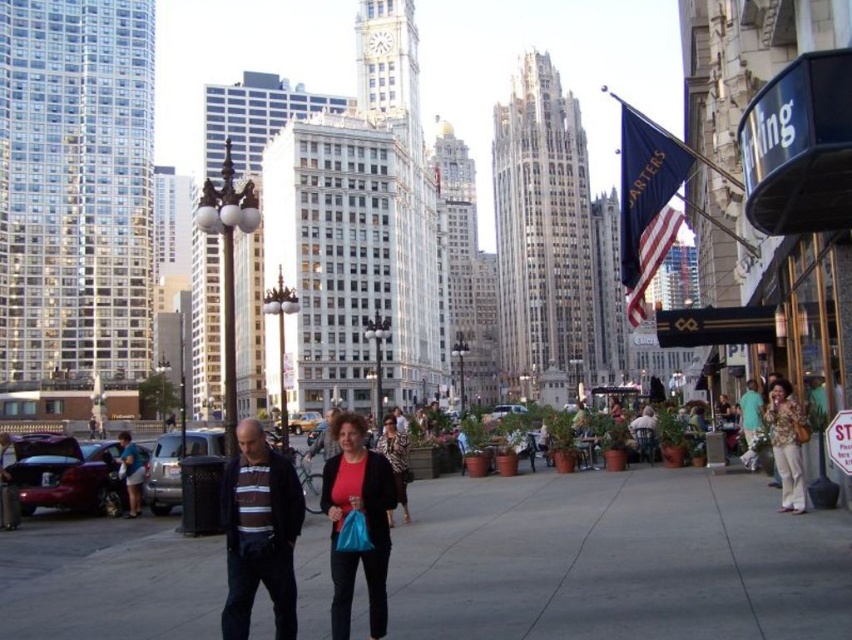
Is green cotton shirt at lower right positioned behind striped sweater at center?

Yes, green cotton shirt at lower right is further from the viewer.

Which is behind, point (747, 467) or point (320, 435)?

Point (320, 435)

Locate an element on the screen. The width and height of the screenshot is (852, 640). green cotton shirt at lower right is located at coordinates (750, 420).

Locate an element on the screen. green cotton shirt at lower right is located at coordinates (750, 420).

The image size is (852, 640). What do you see at coordinates (616, 561) in the screenshot?
I see `gray concrete pavement at center` at bounding box center [616, 561].

This screenshot has height=640, width=852. I want to click on gray concrete pavement at center, so click(616, 561).

Locate an element on the screen. The height and width of the screenshot is (640, 852). gray concrete pavement at center is located at coordinates (616, 561).

Does striped knit sweater at center have a larger size compared to matte red shirt at center?

Indeed, striped knit sweater at center has a larger size compared to matte red shirt at center.

The width and height of the screenshot is (852, 640). Describe the element at coordinates (258, 532) in the screenshot. I see `striped knit sweater at center` at that location.

Which is behind, point (291, 465) or point (350, 568)?

Positioned behind is point (291, 465).

Locate an element on the screen. This screenshot has width=852, height=640. striped knit sweater at center is located at coordinates (258, 532).